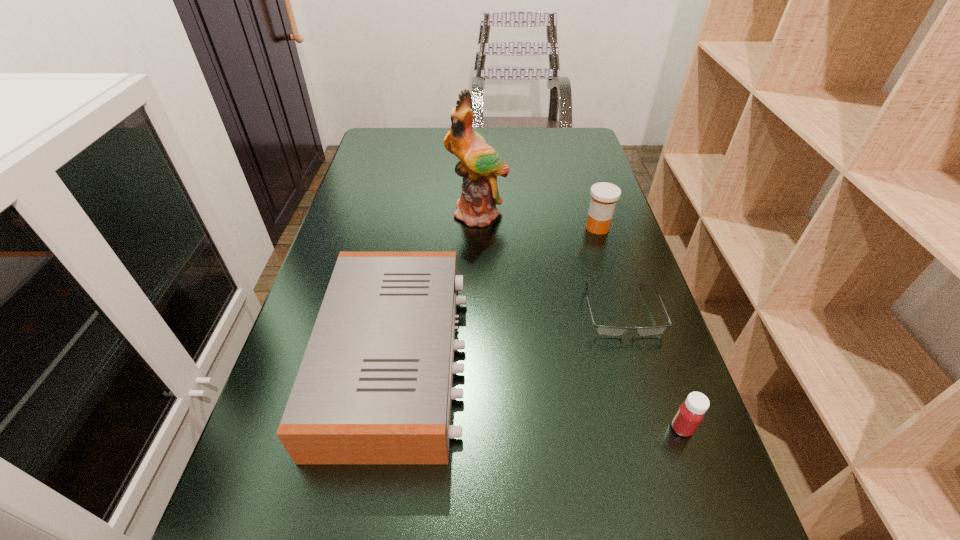
At what (x,y) coordinates should I click in order to perform the action: click on free space that satisfies the following two spatial constraints: 1. on the control panel of the shorter medicine; 2. on the left side of the radio receiver. Please return your answer as a coordinate pair (x, y). Looking at the image, I should click on (385, 428).

Locate an element on the screen. The image size is (960, 540). vacant space that satisfies the following two spatial constraints: 1. on the label of the taller medicine; 2. on the control panel of the radio receiver is located at coordinates (638, 359).

You are a GUI agent. You are given a task and a screenshot of the screen. Output one action in this format:
    pyautogui.click(x=<x>, y=<y>)
    Task: Click on the free region that satisfies the following two spatial constraints: 1. on the label of the taller medicine; 2. on the right side of the nearer medicine
    Image resolution: width=960 pixels, height=540 pixels.
    Given the screenshot: What is the action you would take?
    pyautogui.click(x=660, y=428)

Identify the location of vacant space that satisfies the following two spatial constraints: 1. on the front-facing side of the nearer medicine; 2. on the right side of the parrot. [x=476, y=428].

Where is `free region that satisfies the following two spatial constraints: 1. on the label of the taller medicine; 2. on the control panel of the radio receiver`? free region that satisfies the following two spatial constraints: 1. on the label of the taller medicine; 2. on the control panel of the radio receiver is located at coordinates (638, 359).

Where is `vacant point that satisfies the following two spatial constraints: 1. on the label of the farther medicine; 2. on the right side of the nearer medicine`? Image resolution: width=960 pixels, height=540 pixels. vacant point that satisfies the following two spatial constraints: 1. on the label of the farther medicine; 2. on the right side of the nearer medicine is located at coordinates (660, 428).

At what (x,y) coordinates should I click in order to perform the action: click on free space that satisfies the following two spatial constraints: 1. on the front-facing side of the parrot; 2. on the left side of the shorter medicine. Please return your answer as a coordinate pair (x, y). This screenshot has width=960, height=540. Looking at the image, I should click on (476, 428).

You are a GUI agent. You are given a task and a screenshot of the screen. Output one action in this format:
    pyautogui.click(x=<x>, y=<y>)
    Task: Click on the vacant space that satisfies the following two spatial constraints: 1. on the front-facing side of the shortest object; 2. on the control panel of the radio receiver
    
    Given the screenshot: What is the action you would take?
    pyautogui.click(x=636, y=359)

You are a GUI agent. You are given a task and a screenshot of the screen. Output one action in this format:
    pyautogui.click(x=<x>, y=<y>)
    Task: Click on the free space that satisfies the following two spatial constraints: 1. on the control panel of the radio receiver; 2. on the left side of the nearer medicine
    This screenshot has width=960, height=540.
    Given the screenshot: What is the action you would take?
    pyautogui.click(x=385, y=428)